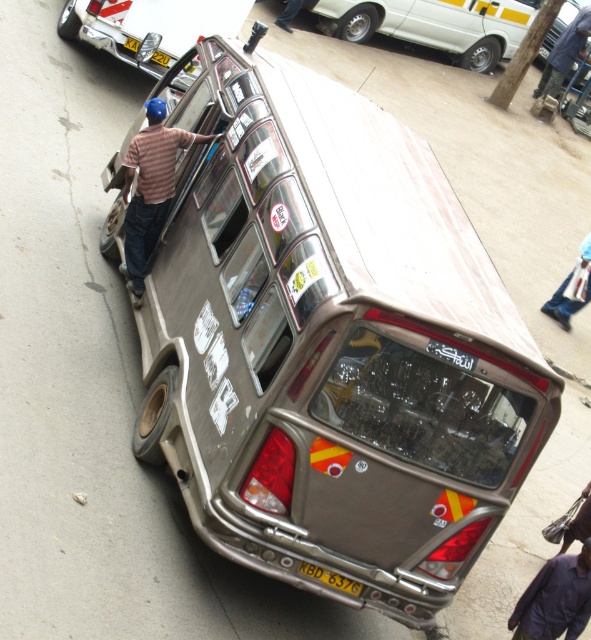
Who is higher up, metallic silver van at center or brown striped shirt at upper left?

Positioned higher is brown striped shirt at upper left.

Does metallic silver van at center appear under brown striped shirt at upper left?

Correct, metallic silver van at center is located below brown striped shirt at upper left.

Is point (284, 480) positioned behind point (154, 180)?

No, it is in front of (154, 180).

Where is `metallic silver van at center`? metallic silver van at center is located at coordinates (330, 342).

Can you confirm if metallic silver car at upper left is bigger than yellow metallic license plate at bottom center?

Indeed, metallic silver car at upper left has a larger size compared to yellow metallic license plate at bottom center.

Between metallic silver car at upper left and yellow metallic license plate at bottom center, which one is positioned higher?

metallic silver car at upper left

The image size is (591, 640). Identify the location of metallic silver car at upper left. (150, 26).

I want to click on metallic silver car at upper left, so click(x=150, y=26).

Who is more distant from viewer, [336,0] or [131,259]?

Point [336,0]

Is white glossy van at upper right in front of brown striped shirt at upper left?

That is False.

Who is more forward, (363, 10) or (209, 136)?

Positioned in front is point (209, 136).

Find the location of a particular element. white glossy van at upper right is located at coordinates (434, 24).